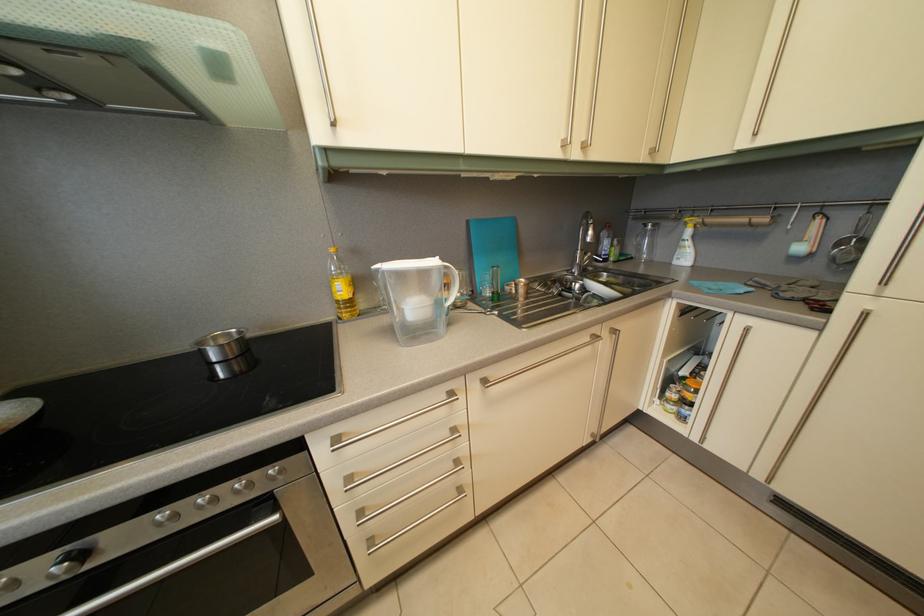
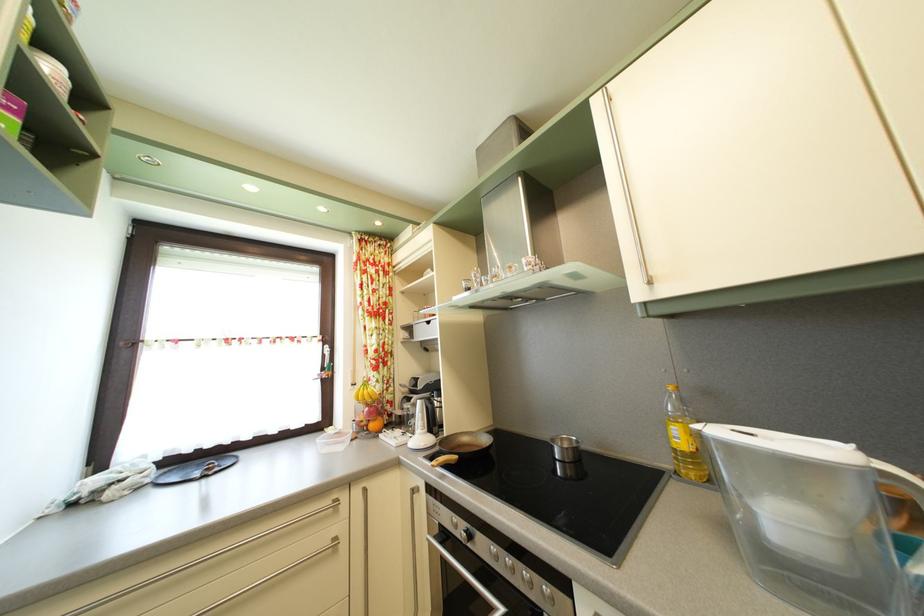
Where in the second image is the point corresponding to (362,259) from the first image?

(715, 400)